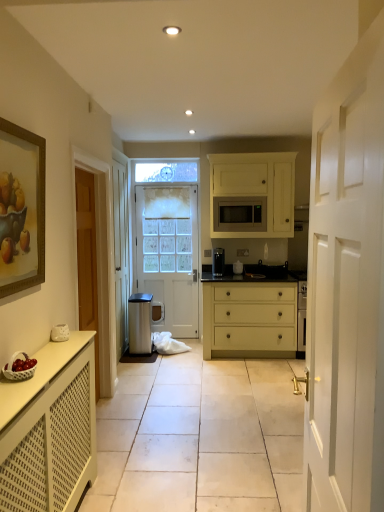
The height and width of the screenshot is (512, 384). Identify the location of free space in front of white matte drawer at center. (236, 373).